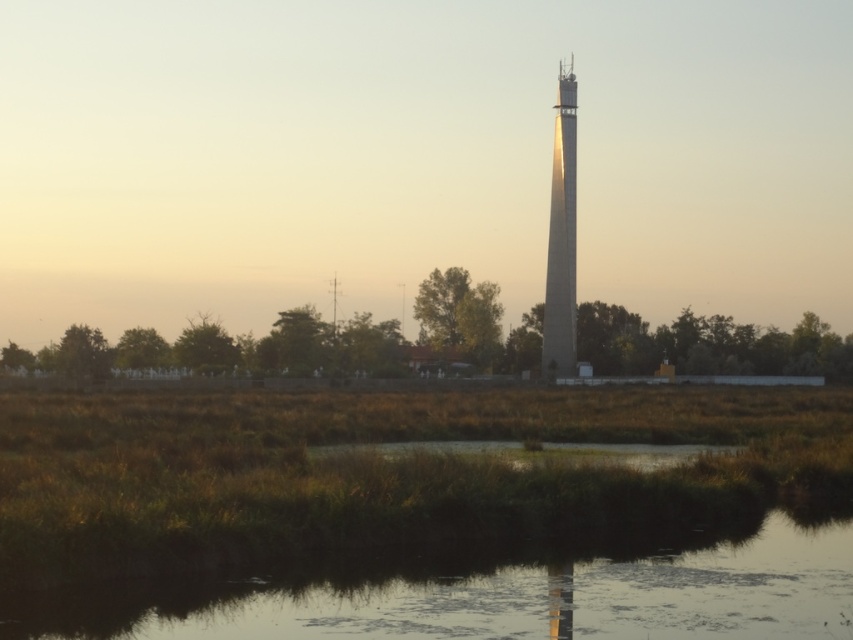
Does transparent water at lower center have a larger size compared to smooth concrete tower at center?

No.

Can you confirm if transparent water at lower center is taller than smooth concrete tower at center?

No.

Who is more forward, [527,609] or [573,113]?

Positioned in front is point [527,609].

The image size is (853, 640). Identify the location of transparent water at lower center. (503, 596).